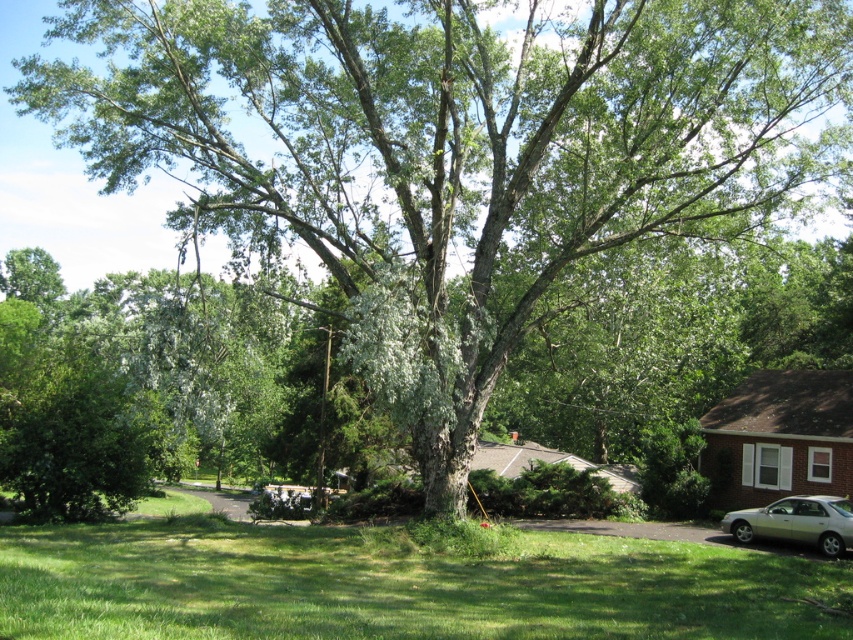
Question: Is green grass at lower center in front of silver metallic car at lower right?

Choices:
 (A) no
 (B) yes

Answer: (B)

Question: Which point is farther from the camera taking this photo?

Choices:
 (A) (787, 538)
 (B) (3, 582)

Answer: (A)

Question: Which point appears closest to the camera in this image?

Choices:
 (A) (248, 572)
 (B) (831, 502)

Answer: (A)

Question: Can you confirm if green grass at lower center is positioned to the left of silver metallic car at lower right?

Choices:
 (A) yes
 (B) no

Answer: (A)

Question: Which object is farther from the camera taking this photo?

Choices:
 (A) silver metallic car at lower right
 (B) green grass at lower center

Answer: (A)

Question: Can you confirm if green grass at lower center is bigger than silver metallic car at lower right?

Choices:
 (A) no
 (B) yes

Answer: (B)